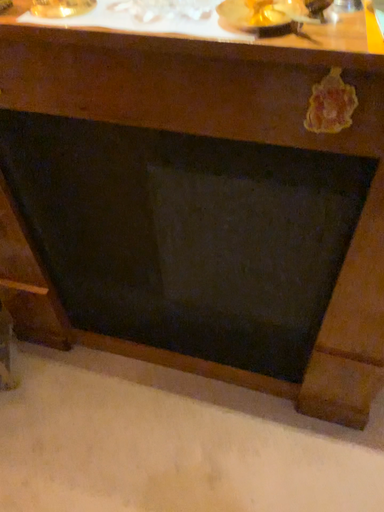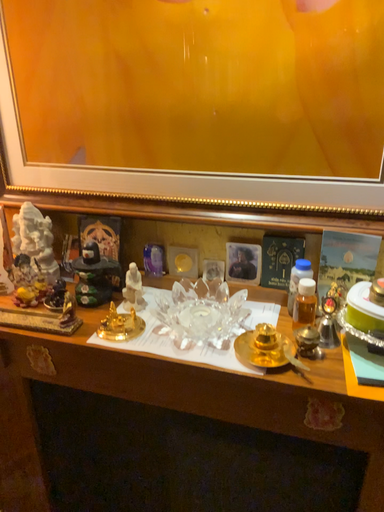
Question: How did the camera likely rotate when shooting the video?

Choices:
 (A) rotated downward
 (B) rotated upward

Answer: (B)